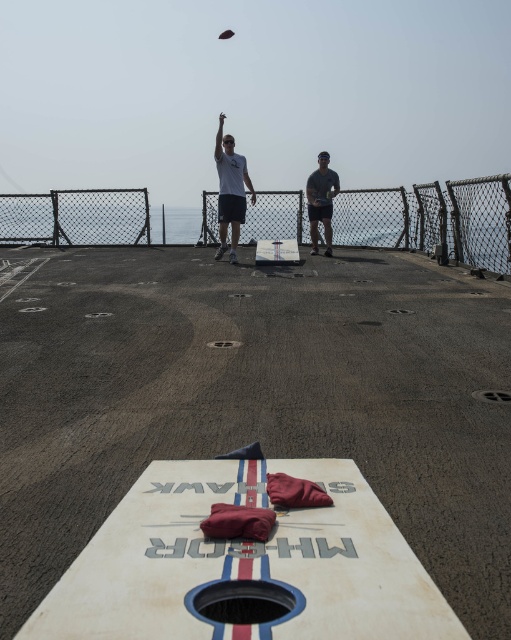
Question: Can you confirm if white matte t-shirt at upper center is wider than dark brown wooden frisbee at upper center?

Choices:
 (A) yes
 (B) no

Answer: (A)

Question: Based on their relative distances, which object is nearer to the white matte t-shirt at upper center?

Choices:
 (A) dark gray fabric at center
 (B) dark brown wooden frisbee at upper center

Answer: (A)

Question: Is white matte t-shirt at upper center to the left of dark gray fabric at center from the viewer's perspective?

Choices:
 (A) yes
 (B) no

Answer: (A)

Question: Observing the image, what is the correct spatial positioning of white matte t-shirt at upper center in reference to dark brown wooden frisbee at upper center?

Choices:
 (A) above
 (B) below

Answer: (B)

Question: Estimate the real-world distances between objects in this image. Which object is closer to the white matte t-shirt at upper center?

Choices:
 (A) dark brown wooden frisbee at upper center
 (B) dark gray fabric at center

Answer: (B)

Question: Which point is farther to the camera?

Choices:
 (A) dark brown wooden frisbee at upper center
 (B) dark gray fabric at center
 (C) white matte t-shirt at upper center

Answer: (A)